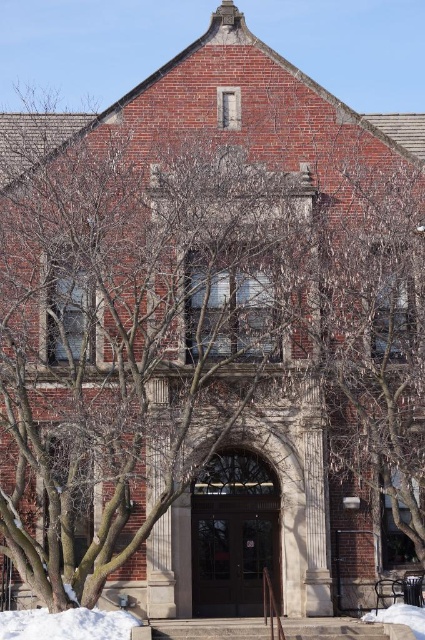
Is white powdery snow at lower left taller than white fluffy snow at lower right?

Yes, white powdery snow at lower left is taller than white fluffy snow at lower right.

Which is in front, point (136, 624) or point (419, 625)?

Point (136, 624) is more forward.

You are a GUI agent. You are given a task and a screenshot of the screen. Output one action in this format:
    pyautogui.click(x=<x>, y=<y>)
    Task: Click on the white powdery snow at lower left
    This screenshot has width=425, height=640.
    Given the screenshot: What is the action you would take?
    pyautogui.click(x=67, y=625)